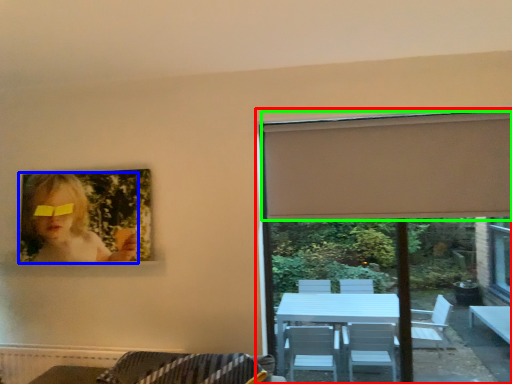
Question: Which object is the closest to the window (highlighted by a red box)? Choose among these: woman (highlighted by a blue box) or curtain (highlighted by a green box).

Choices:
 (A) woman
 (B) curtain

Answer: (B)